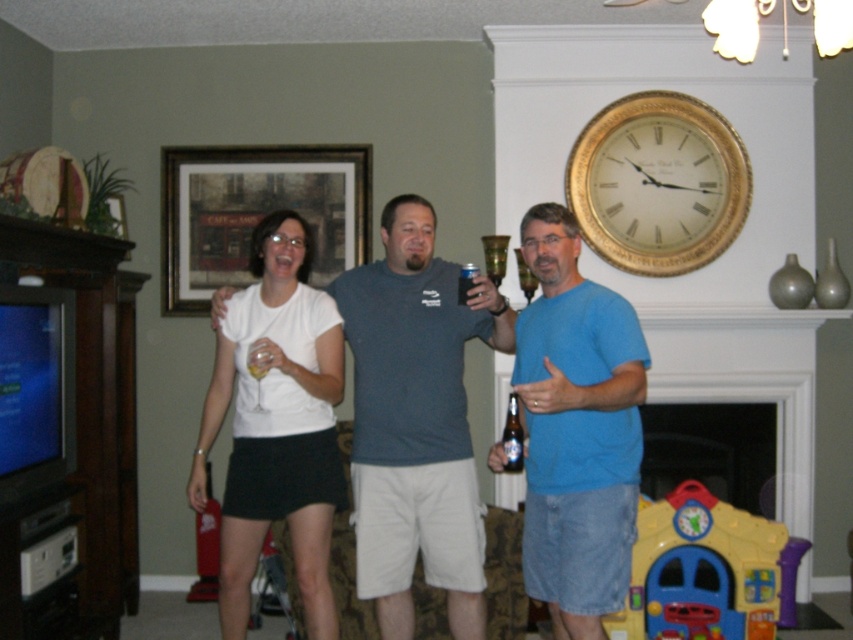
From the picture: You are standing in the living room and want to place a new picture frame exactly where the clear glass bottle at center is located. What are the coordinates you should use?

The coordinates for the clear glass bottle at center are at point [512,436].

In the living room scene, there are three people. The person on the left is holding a wine glass, the middle person is holding a can, and there is a point at coordinates (x=512, y=436). What object is the point located on?

The point at (x=512, y=436) is located on the clear glass bottle at center.